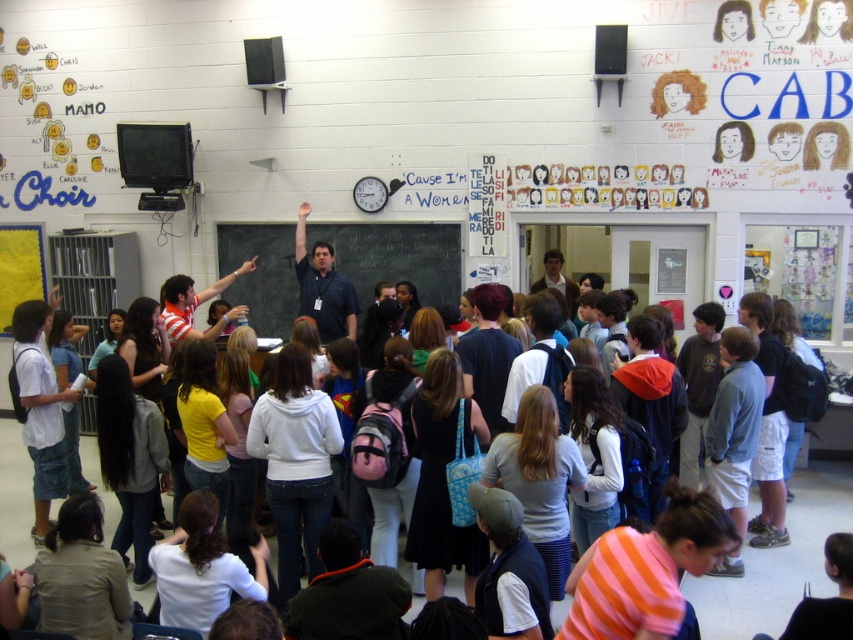
You are a student in the classroom and want to know where the blackboard at center is positioned relative to the clock. Can you determine its location?

The blackboard at center is located at point (395, 257), which is slightly to the left and below the clock positioned near the center of the walls.

You are a student in the classroom and you see the point marked at coordinates (778, 563). What object is located at that point?

The point at coordinates (778, 563) corresponds to the white cotton hoodie at center.

You are a student in the classroom and want to see the blackboard at center clearly. However, there is a white cotton hoodie at center blocking your view. Can you move around the hoodie to see the blackboard?

The white cotton hoodie at center is in front of the blackboard at center, so you can move around the hoodie to get a clear view of the blackboard.